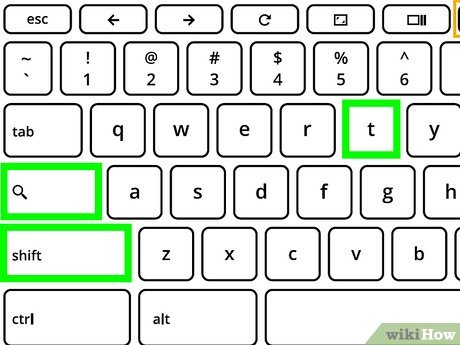
You are a GUI agent. You are given a task and a screenshot of the screen. Output one action in this format:
    pyautogui.click(x=<x>, y=<y>)
    Task: Click on the partially visible keys on computer keyboard
    Image resolution: width=460 pixels, height=345 pixels.
    Given the screenshot: What is the action you would take?
    pyautogui.click(x=429, y=321), pyautogui.click(x=458, y=259), pyautogui.click(x=445, y=180), pyautogui.click(x=439, y=124), pyautogui.click(x=451, y=76), pyautogui.click(x=456, y=21)